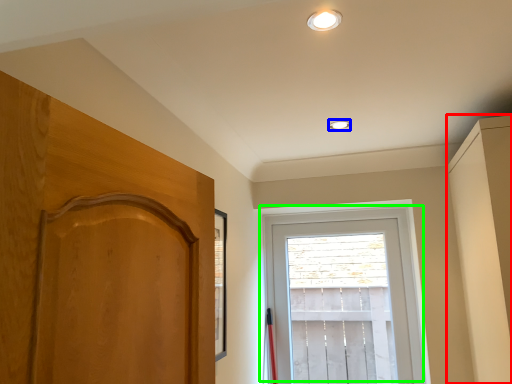
Question: Considering the real-world distances, which object is farthest from dresser (highlighted by a red box)? lighting (highlighted by a blue box) or window (highlighted by a green box)?

Choices:
 (A) lighting
 (B) window

Answer: (A)